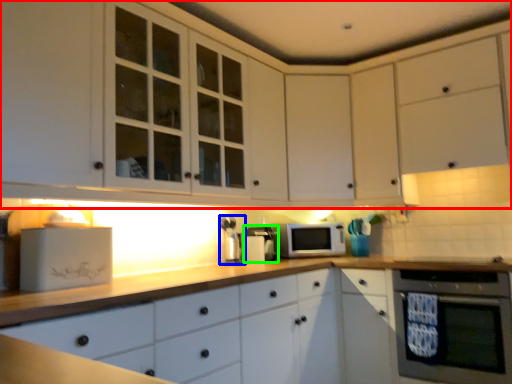
Question: Which object is positioned closest to cabinetry (highlighted by a red box)? Select from coffee machine (highlighted by a blue box) and coffee machine (highlighted by a green box).

Choices:
 (A) coffee machine
 (B) coffee machine

Answer: (B)